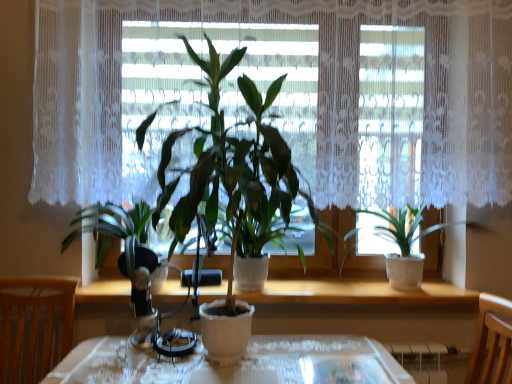
Question: Considering the positions of point (420, 253) and point (284, 210), is point (420, 253) closer or farther from the camera than point (284, 210)?

Choices:
 (A) farther
 (B) closer

Answer: (A)

Question: From a real-world perspective, is green matte plant at right, positioned as the first houseplant in right-to-left order, positioned above or below green matte plant at center, placed as the 2th houseplant when sorted from right to left?

Choices:
 (A) below
 (B) above

Answer: (A)

Question: Which of these objects is positioned closest to the wooden at center?

Choices:
 (A) wooden chair at left
 (B) green matte plant at center, placed as the 2th houseplant when sorted from right to left
 (C) green matte plant at right, placed as the third houseplant when sorted from left to right
 (D) white lace curtain at center
 (E) green matte plant at left, which is the third houseplant from right to left

Answer: (C)

Question: Estimate the real-world distances between objects in this image. Which object is closer to the wooden chair at left?

Choices:
 (A) green matte plant at left, which is the third houseplant from right to left
 (B) wooden at center
 (C) green matte plant at center, placed as the 2th houseplant when sorted from right to left
 (D) green matte plant at right, placed as the third houseplant when sorted from left to right
 (E) white lace curtain at center

Answer: (A)